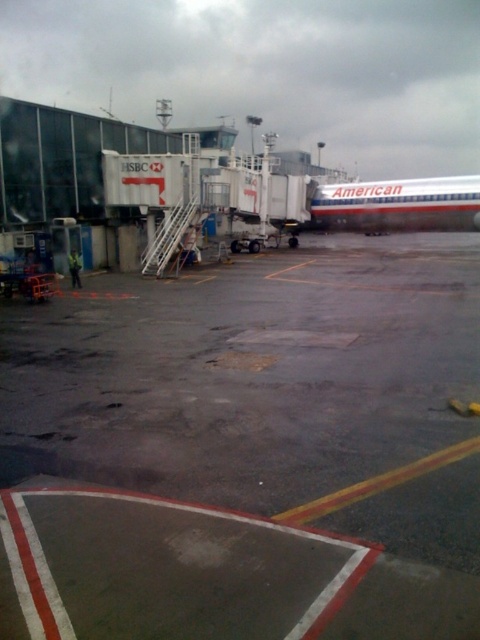
Who is more forward, (446, 336) or (425, 182)?

Point (446, 336) is in front.

Based on the photo, is wet asphalt tarmac at center positioned in front of white metallic airplane at center?

Yes, wet asphalt tarmac at center is closer to the viewer.

Identify the location of wet asphalt tarmac at center. This screenshot has width=480, height=640. (250, 449).